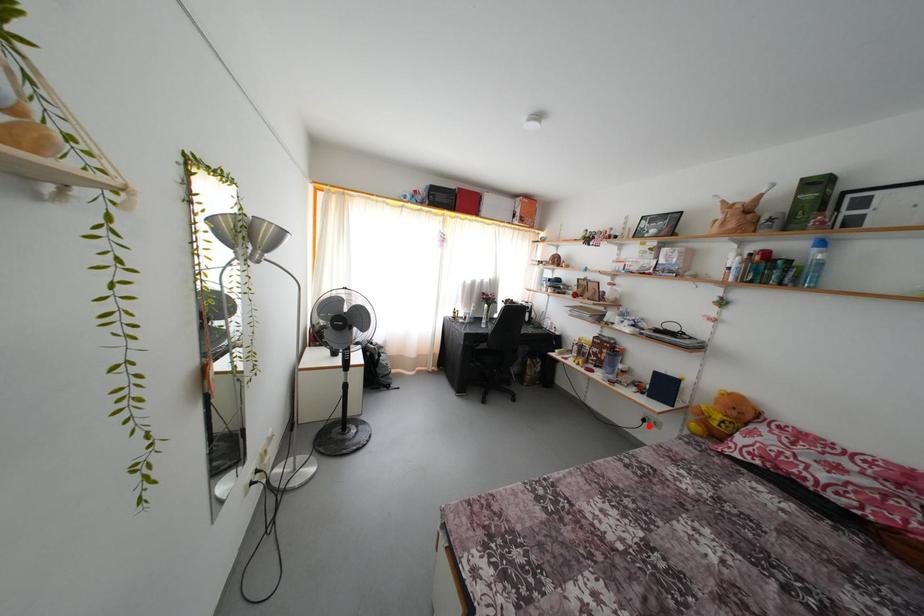
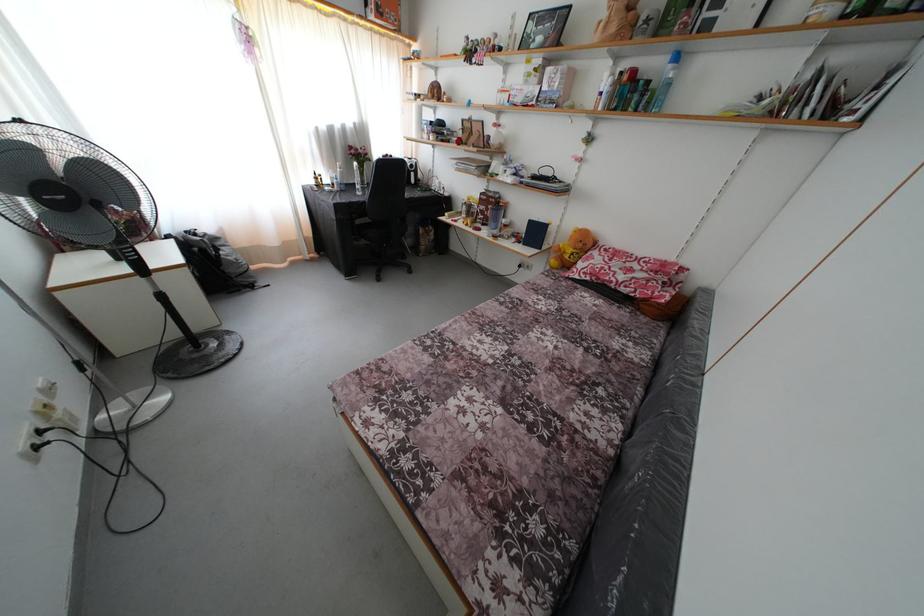
Find the pixel in the second image that matches the highlighted location in the first image.

(525, 272)